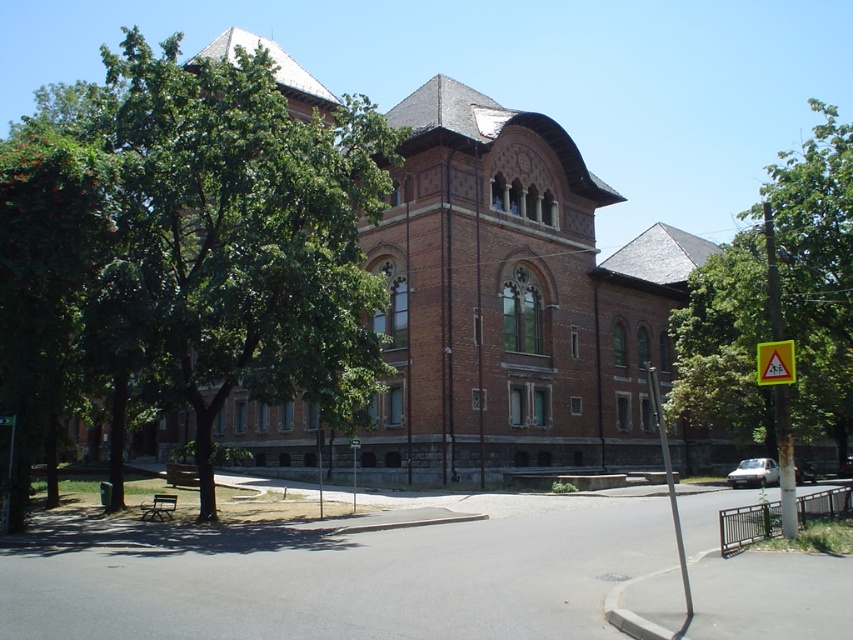
Question: Which object is the farthest from the green leafy tree at center?

Choices:
 (A) yellow plastic sign at center
 (B) yellow triangular sign at upper right
 (C) brown brick church at center
 (D) green leafy tree at right

Answer: (D)

Question: Considering the real-world distances, which object is closest to the green leafy tree at center?

Choices:
 (A) brown brick church at center
 (B) green leafy tree at right

Answer: (A)

Question: Does brown brick church at center have a greater width compared to green leafy tree at right?

Choices:
 (A) no
 (B) yes

Answer: (A)

Question: Does green leafy tree at center have a larger size compared to brown brick church at center?

Choices:
 (A) no
 (B) yes

Answer: (B)

Question: Does yellow triangular sign at upper right appear on the right side of yellow plastic sign at center?

Choices:
 (A) yes
 (B) no

Answer: (A)

Question: Which point is closer to the camera?

Choices:
 (A) (355, 452)
 (B) (473, 348)
 (C) (782, 355)

Answer: (C)